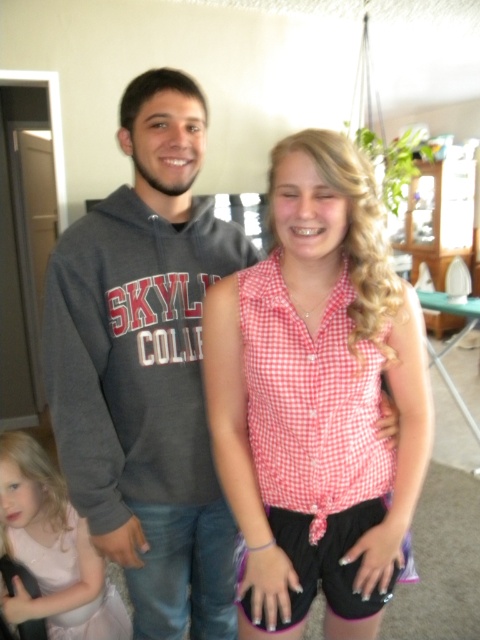
Based on the coordinates provided, which object is located at point (145, 368) in the scene?

The point (145, 368) marks the location of the dark gray hoodie at center.

You are taking a photo of two friends. You notice the pink checkered shirt at center and the dark gray hoodie at center. Which one is nearer to the camera?

The pink checkered shirt at center is closer to the viewer than the dark gray hoodie at center, so it is nearer to the camera.